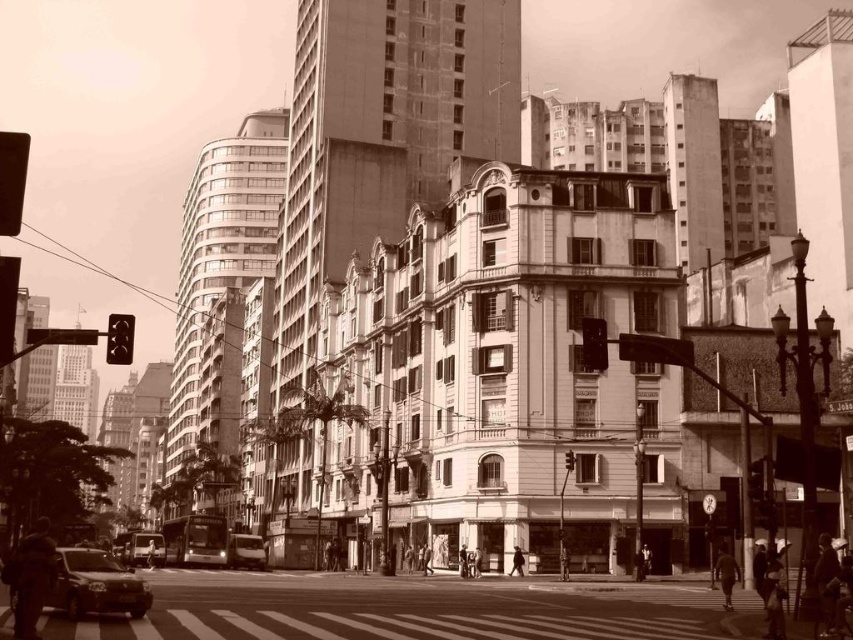
From the picture: You are a pedestrian waiting at the crosswalk. You notice the black plastic traffic light at upper right and the shiny silver bus at center. Which object is above the other?

The black plastic traffic light at upper right is positioned over the shiny silver bus at center.

You are a city planner analyzing this street scene. You need to determine if the shiny silver bus at center can fit through a narrow alley that is only as wide as the metallic traffic light at center. Based on the scene description, can the bus fit through the alley?

The shiny silver bus at center is wider than the metallic traffic light at center, so it cannot fit through the alley which is only as wide as the traffic light.